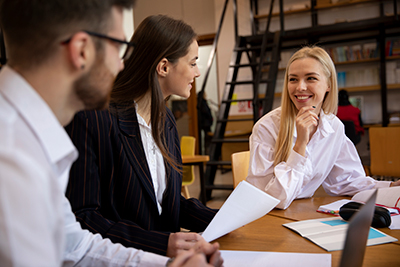
Identify the location of brown wooden table surface. (x=269, y=231), (x=191, y=156).